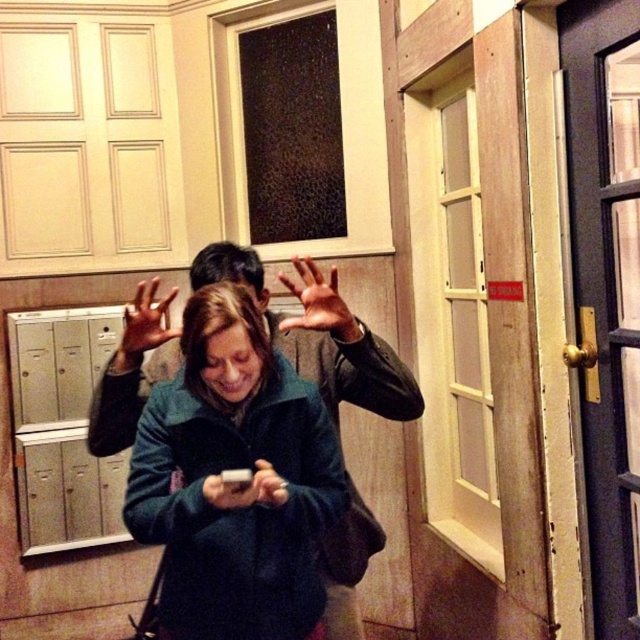
Is matte black phone at center thinner than matte white phone at center?

Incorrect, matte black phone at center's width is not less than matte white phone at center's.

Is matte black phone at center positioned at the back of matte white phone at center?

No, it is not.

Who is more distant from viewer, (220, 488) or (280, 486)?

The point (280, 486) is behind.

You are a GUI agent. You are given a task and a screenshot of the screen. Output one action in this format:
    pyautogui.click(x=<x>, y=<y>)
    Task: Click on the matte black phone at center
    The height and width of the screenshot is (640, 640).
    Given the screenshot: What is the action you would take?
    pyautogui.click(x=228, y=492)

Is matte green coat at center shorter than matte black phone at center?

Incorrect, matte green coat at center's height does not fall short of matte black phone at center's.

Based on the photo, does matte green coat at center appear over matte black phone at center?

Yes.

This screenshot has height=640, width=640. In order to click on matte green coat at center in this screenshot , I will do `click(237, 481)`.

Between matte black hands at center and matte black phone at center, which one has less height?

With less height is matte black phone at center.

Based on the photo, is matte black hands at center positioned before matte black phone at center?

No, matte black hands at center is behind matte black phone at center.

Does point (157, 278) come in front of point (220, 499)?

No.

Identify the location of matte black hands at center. (145, 321).